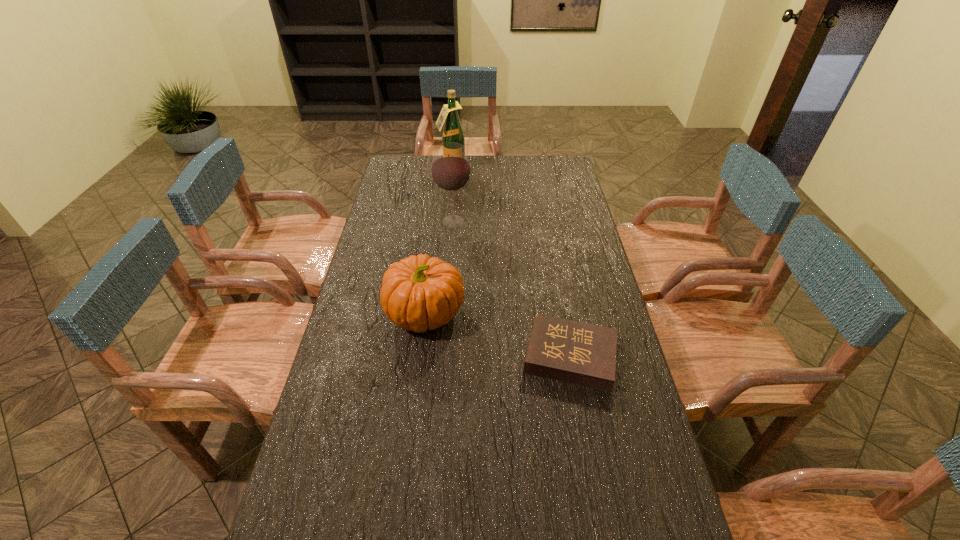
The width and height of the screenshot is (960, 540). Find the location of `the tallest object`. the tallest object is located at coordinates (452, 132).

Locate an element on the screen. The height and width of the screenshot is (540, 960). liquor is located at coordinates (452, 132).

Where is `the third shortest object`? Image resolution: width=960 pixels, height=540 pixels. the third shortest object is located at coordinates 451,171.

You are a GUI agent. You are given a task and a screenshot of the screen. Output one action in this format:
    pyautogui.click(x=<x>, y=<y>)
    Task: Click on the alcohol
    The height and width of the screenshot is (540, 960).
    Given the screenshot: What is the action you would take?
    pyautogui.click(x=451, y=171)

You are a GUI agent. You are given a task and a screenshot of the screen. Output one action in this format:
    pyautogui.click(x=<x>, y=<y>)
    Task: Click on the pumpkin
    The height and width of the screenshot is (540, 960).
    Given the screenshot: What is the action you would take?
    pyautogui.click(x=418, y=293)

Locate an element on the screen. This screenshot has height=540, width=960. the rightmost object is located at coordinates pyautogui.click(x=574, y=352).

Locate an element on the screen. hardback book is located at coordinates (574, 352).

Where is `vacant space located 0.070m on the front-facing side of the liquor`? vacant space located 0.070m on the front-facing side of the liquor is located at coordinates (450, 187).

I want to click on free space located on the right of the third nearest object, so click(499, 222).

Find the location of `vacant position located on the surface of the pumpkin`. vacant position located on the surface of the pumpkin is located at coordinates (542, 313).